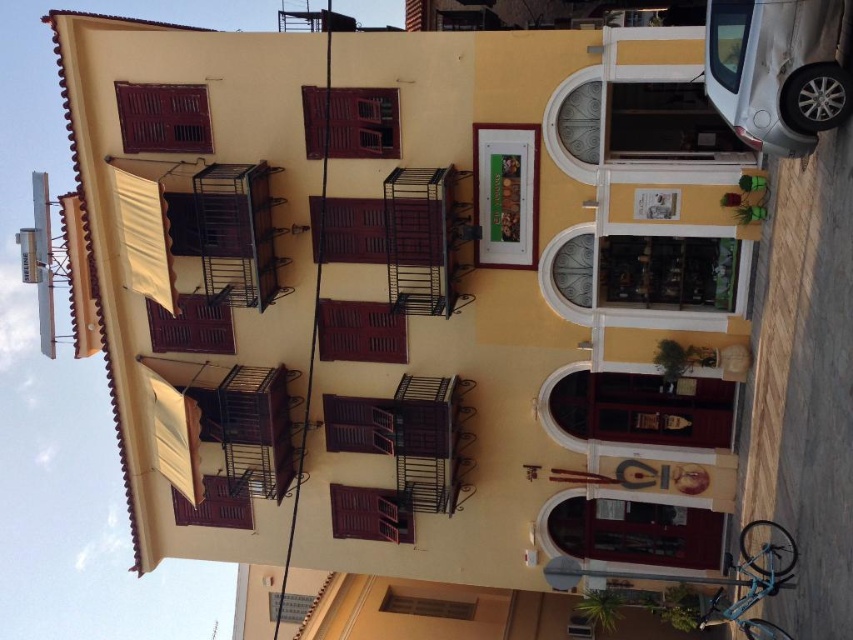
Between wooden at center and wooden at lower center, which one has more height?

With more height is wooden at lower center.

From the picture: Can you confirm if wooden at center is bigger than wooden at lower center?

No, wooden at center is not bigger than wooden at lower center.

Which is behind, point (355, 128) or point (360, 492)?

Positioned behind is point (360, 492).

This screenshot has width=853, height=640. I want to click on wooden at center, so click(351, 122).

Consider the image. Does wooden at center appear on the right side of brown wooden balcony at center?

Indeed, wooden at center is positioned on the right side of brown wooden balcony at center.

At what (x,y) coordinates should I click in order to perform the action: click on wooden at center. Please return your answer as a coordinate pair (x, y). Looking at the image, I should click on (351, 122).

Can you confirm if brown wooden balcony at upper left is bigger than wooden at lower center?

No.

Which of these two, brown wooden balcony at upper left or wooden at lower center, stands shorter?

With less height is wooden at lower center.

What do you see at coordinates (163, 116) in the screenshot? The height and width of the screenshot is (640, 853). I see `brown wooden balcony at upper left` at bounding box center [163, 116].

Find the location of a particular element. This screenshot has width=853, height=640. brown wooden balcony at upper left is located at coordinates (163, 116).